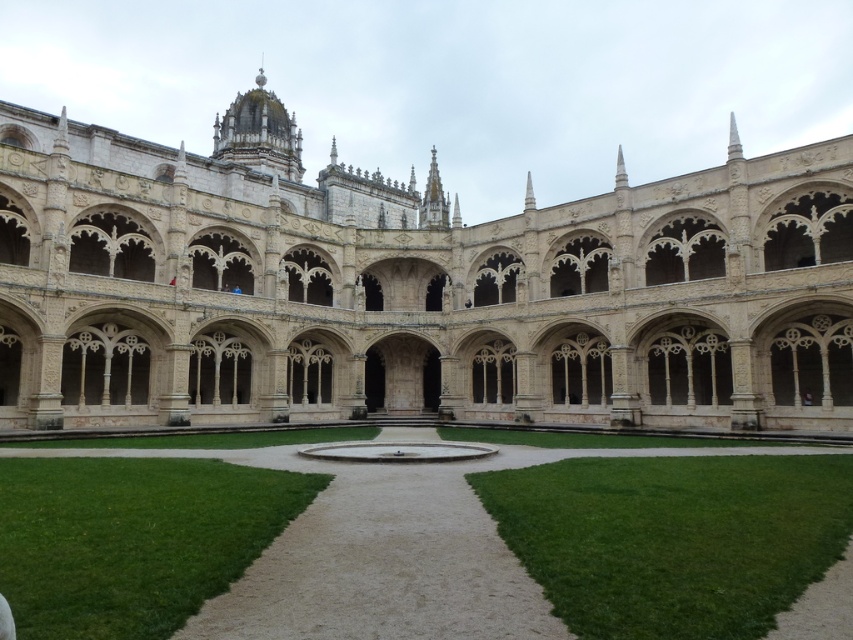
Consider the image. You are a tour guide leading a group in the courtyard of the historic building. You want to move from the white stone monastery at center to the green grass at center. What is the shortest distance you need to walk?

The shortest distance you need to walk from the white stone monastery at center to the green grass at center is 41.42 meters.

You are standing in the courtyard of a historic building. There is a point marked at coordinates (410,288). What is located at that point?

The point at coordinates (410,288) marks the location of the white stone monastery at center.